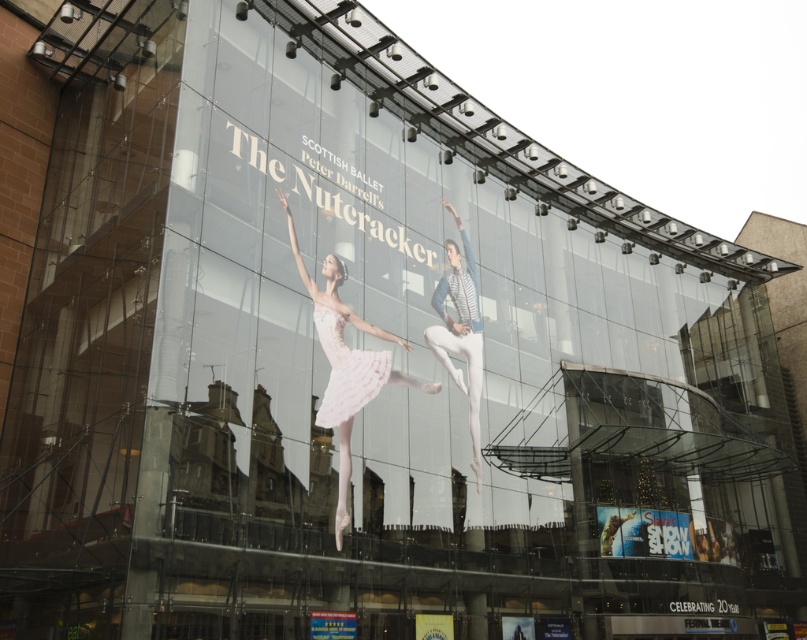
You are an art student analyzing the advertisement on the glass facade. You notice two white elements at the center of the ad. The first is a ballet dancer labeled as the white matte ballet dancer at center, and the second is a white tulle skirt at center. Based on the description, which of these two elements is wider?

The white matte ballet dancer at center is wider than the white tulle skirt at center according to the description.

You are a costume designer analyzing the advertisement on the glass facade. You need to determine which of the two skirts, the light pink satin tutu at center or the white tulle skirt at center, has a wider silhouette based on the description provided. Which one is wider?

The light pink satin tutu at center has a wider silhouette than the white tulle skirt at center, as stated in the description.